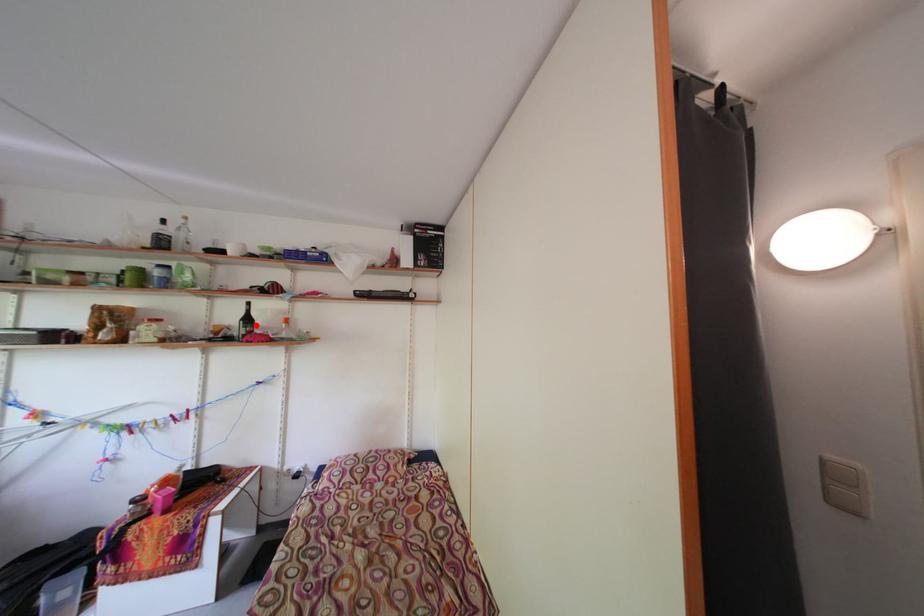
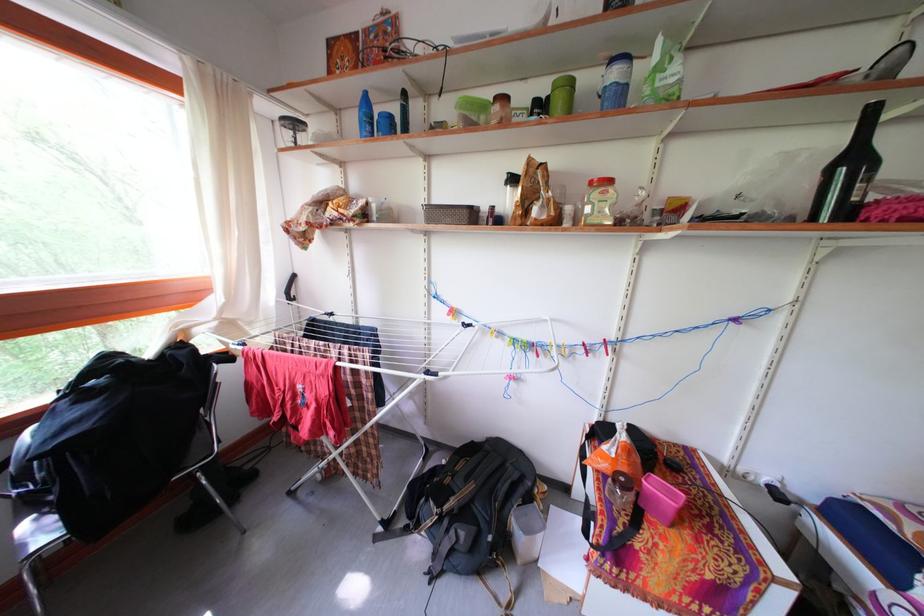
Where in the second image is the point corresponding to the highlighted location from the first image?

(861, 166)